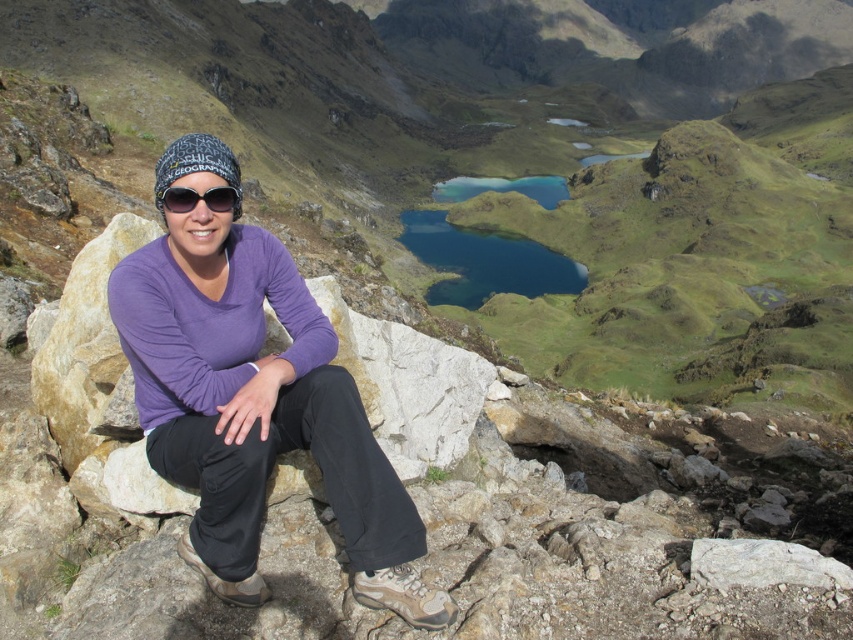
Question: Among these points, which one is farthest from the camera?

Choices:
 (A) (189, 348)
 (B) (192, 202)

Answer: (A)

Question: Can you confirm if purple cotton shirt at center is positioned below sunglasses at center?

Choices:
 (A) no
 (B) yes

Answer: (B)

Question: Does purple cotton shirt at center have a larger size compared to sunglasses at center?

Choices:
 (A) no
 (B) yes

Answer: (B)

Question: Is purple cotton shirt at center further to camera compared to sunglasses at center?

Choices:
 (A) no
 (B) yes

Answer: (A)